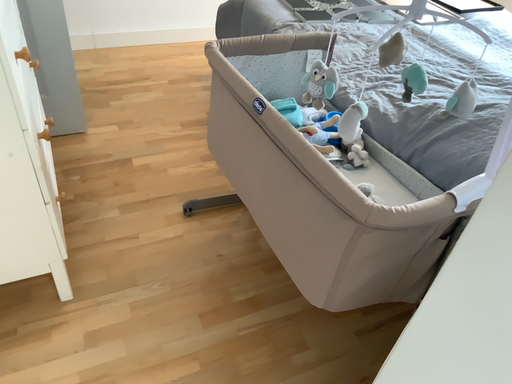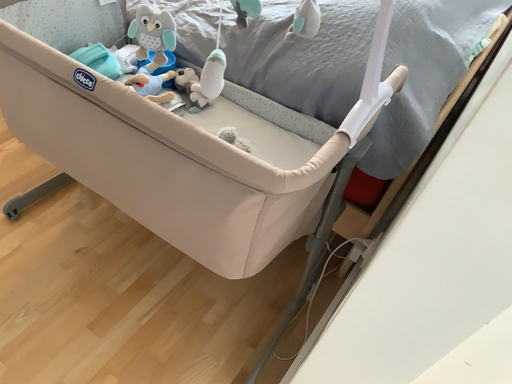
Question: Which way did the camera rotate in the video?

Choices:
 (A) rotated downward
 (B) rotated upward

Answer: (A)